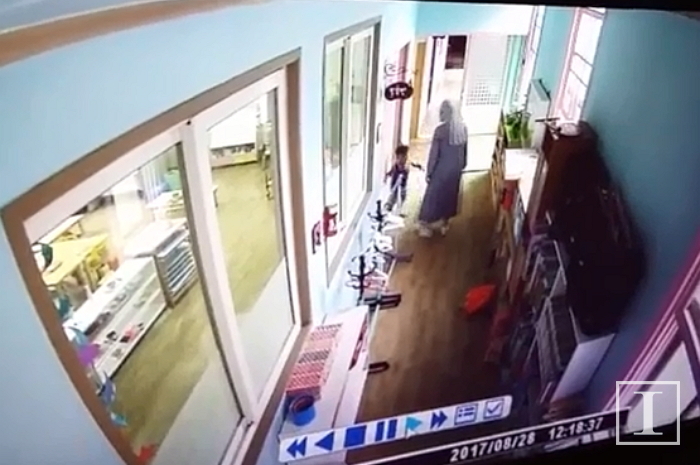
Identify the location of wall. (176, 69), (428, 15), (662, 103).